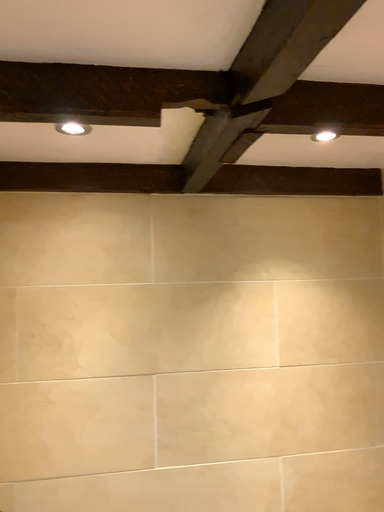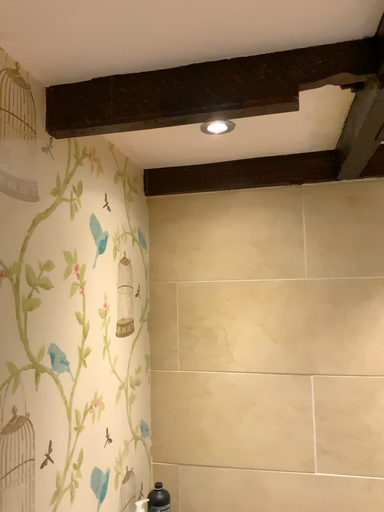
Question: How did the camera likely rotate when shooting the video?

Choices:
 (A) rotated left
 (B) rotated right

Answer: (A)